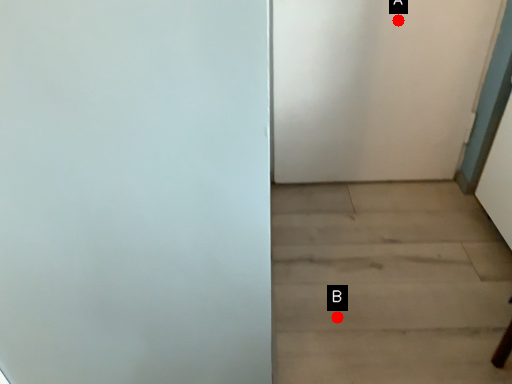
Question: Two points are circled on the image, labeled by A and B beside each circle. Among these points, which one is farthest from the camera?

Choices:
 (A) A is further
 (B) B is further

Answer: (A)